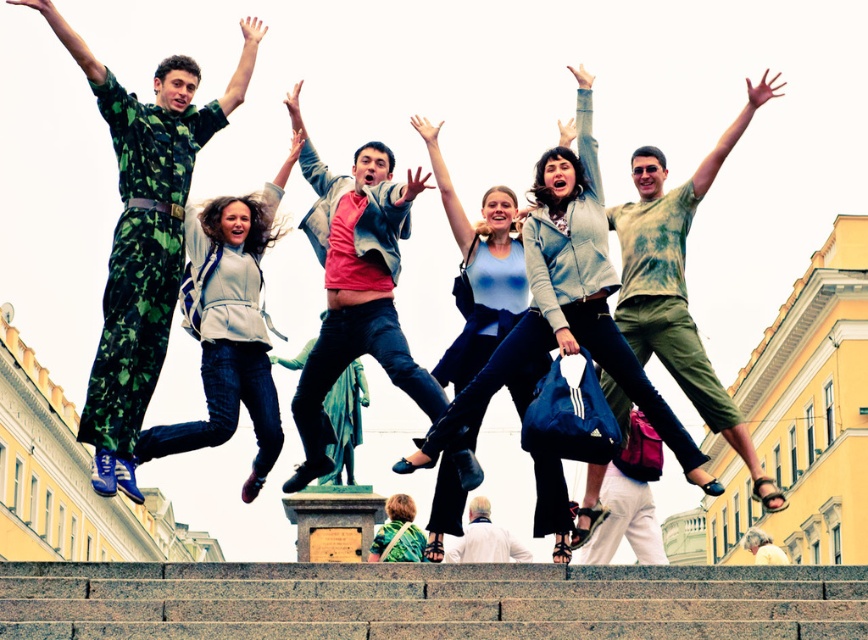
Consider the image. Does green camouflage jumpsuit at center have a greater width compared to white fabric shirt at center?

Incorrect, green camouflage jumpsuit at center's width does not surpass white fabric shirt at center's.

Is green camouflage jumpsuit at center further to camera compared to white fabric shirt at center?

No, green camouflage jumpsuit at center is closer to the viewer.

You are a GUI agent. You are given a task and a screenshot of the screen. Output one action in this format:
    pyautogui.click(x=<x>, y=<y>)
    Task: Click on the green camouflage jumpsuit at center
    This screenshot has width=868, height=640.
    Given the screenshot: What is the action you would take?
    click(x=398, y=531)

Can you confirm if granite stairs at lower center is bigger than light blue denim jeans at center?

Incorrect, granite stairs at lower center is not larger than light blue denim jeans at center.

Who is more distant from viewer, (615, 605) or (603, 282)?

Positioned behind is point (603, 282).

At what (x,y) coordinates should I click in order to perform the action: click on granite stairs at lower center. Please return your answer as a coordinate pair (x, y). Looking at the image, I should click on click(428, 600).

Between point (110, 128) and point (386, 353), which one is positioned in front?

Point (386, 353) is in front.

Between point (143, 177) and point (372, 236), which one is positioned in front?

Positioned in front is point (143, 177).

This screenshot has height=640, width=868. In order to click on camouflage jumpsuit at left in this screenshot , I will do `click(142, 234)`.